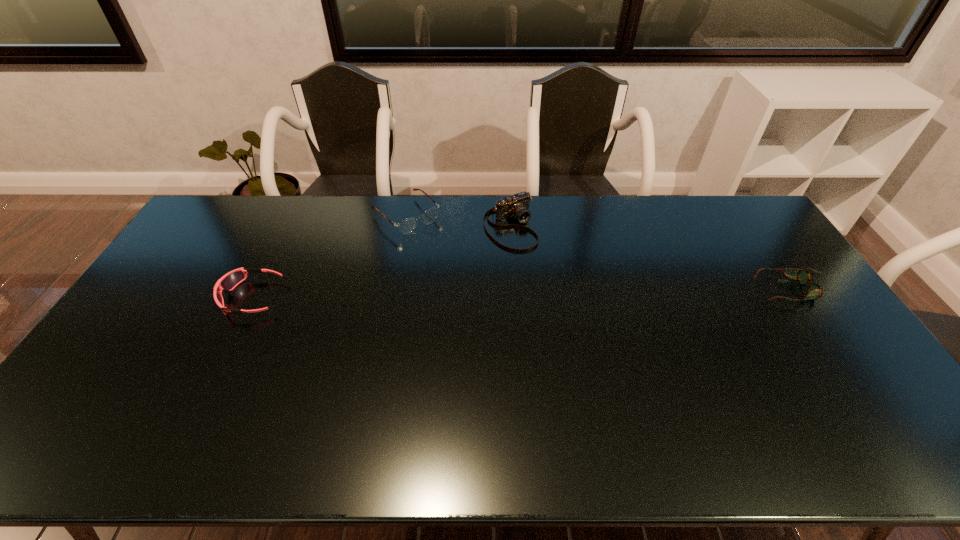
Image resolution: width=960 pixels, height=540 pixels. Identify the location of the leftmost object. (229, 281).

Where is `the shorter spectacles`? Image resolution: width=960 pixels, height=540 pixels. the shorter spectacles is located at coordinates (815, 291).

I want to click on the nearer spectacles, so click(x=815, y=291).

Locate an element on the screen. the tallest object is located at coordinates (517, 206).

In order to click on camera in this screenshot , I will do `click(517, 206)`.

Identify the location of the left spectacles. (406, 226).

The image size is (960, 540). What are the coordinates of `the third object from right to left` in the screenshot? It's located at (406, 226).

What are the coordinates of `free space located 0.060m on the front-facing side of the goggles` in the screenshot? It's located at pyautogui.click(x=204, y=298).

Where is `vacant space positioned 0.070m on the front-facing side of the goggles`? The width and height of the screenshot is (960, 540). vacant space positioned 0.070m on the front-facing side of the goggles is located at coordinates (201, 298).

This screenshot has width=960, height=540. In order to click on free space located on the front-facing side of the shorter spectacles in this screenshot , I will do `click(740, 289)`.